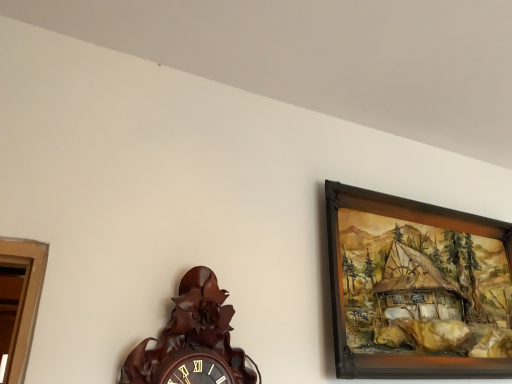
Question: In terms of width, does brown wooden wall clock at lower left look wider or thinner when compared to wooden picture frame at upper right?

Choices:
 (A) wide
 (B) thin

Answer: (A)

Question: Would you say brown wooden wall clock at lower left is inside or outside wooden picture frame at upper right?

Choices:
 (A) outside
 (B) inside

Answer: (A)

Question: In terms of height, does brown wooden wall clock at lower left look taller or shorter compared to wooden picture frame at upper right?

Choices:
 (A) short
 (B) tall

Answer: (A)

Question: Considering the positions of wooden picture frame at upper right and brown wooden wall clock at lower left in the image, is wooden picture frame at upper right taller or shorter than brown wooden wall clock at lower left?

Choices:
 (A) short
 (B) tall

Answer: (B)

Question: Considering the relative positions of wooden picture frame at upper right and brown wooden wall clock at lower left in the image provided, is wooden picture frame at upper right to the left or to the right of brown wooden wall clock at lower left?

Choices:
 (A) left
 (B) right

Answer: (B)

Question: From a real-world perspective, is wooden picture frame at upper right positioned above or below brown wooden wall clock at lower left?

Choices:
 (A) below
 (B) above

Answer: (B)

Question: From the image's perspective, relative to brown wooden wall clock at lower left, is wooden picture frame at upper right above or below?

Choices:
 (A) below
 (B) above

Answer: (B)